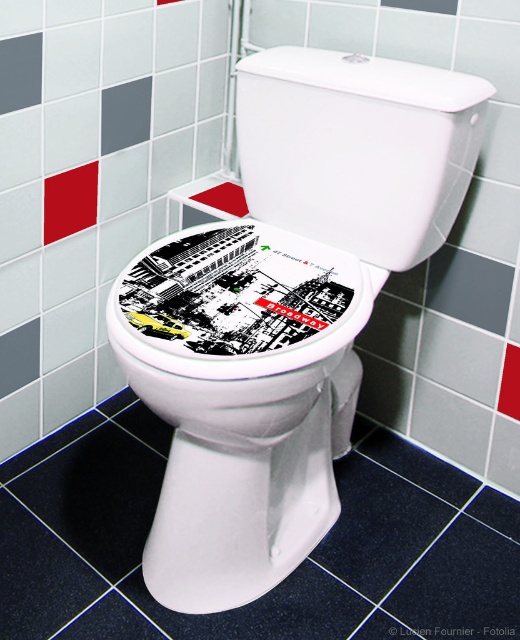
You are designing a bathroom layout and need to place a small decorative item on the white glossy toilet bowl at center. The item must not exceed the size of the black glossy sticker at center. What is the maximum size your item can be?

The maximum size your item can be is the same as the black glossy sticker at center, since the white glossy toilet bowl at center is larger than the sticker, ensuring the item will fit.

You are a bathroom designer who wants to place a new decorative sticker on the toilet bowl. The new sticker is 10 centimeters wide. Based on the current spacing between the white glossy toilet bowl at center and the black glossy sticker at center, will the new sticker fit without overlapping the existing sticker?

The distance between the white glossy toilet bowl at center and the black glossy sticker at center is 8.99 centimeters. Since the new sticker is 10 centimeters wide, it would overlap the existing sticker as 10 cm is wider than the 8.99 cm space available.